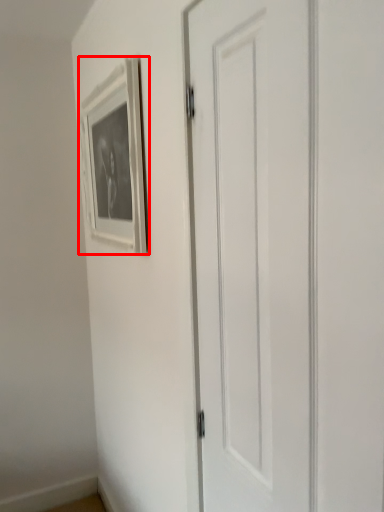
Question: From the image, what is the correct spatial relationship of picture frame (annotated by the red box) in relation to door?

Choices:
 (A) left
 (B) right

Answer: (A)